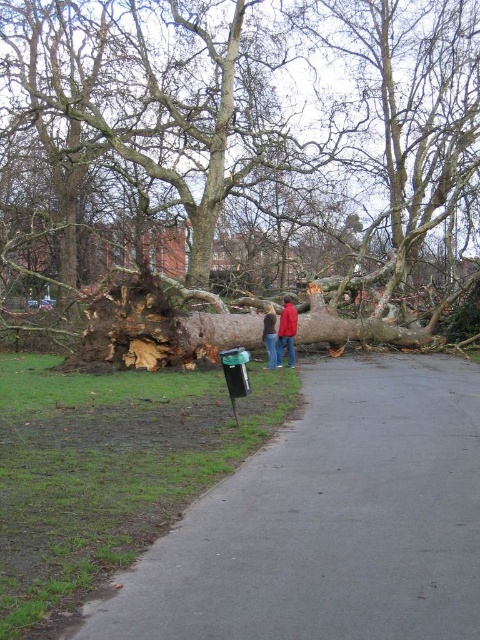
Is point (96, 99) closer to camera compared to point (312, 324)?

No, it is behind (312, 324).

Does brown rough bark tree at center have a lesser height compared to brown rough log at center?

In fact, brown rough bark tree at center may be taller than brown rough log at center.

Is point (275, 179) in front of point (321, 330)?

No, (275, 179) is behind (321, 330).

You are a GUI agent. You are given a task and a screenshot of the screen. Output one action in this format:
    pyautogui.click(x=<x>, y=<y>)
    Task: Click on the brown rough bark tree at center
    
    Given the screenshot: What is the action you would take?
    pyautogui.click(x=252, y=132)

Is point (339, 88) closer to camera compared to point (264, 317)?

That is False.

Can you confirm if brown rough bark tree at center is positioned above red jacket at center?

Correct, brown rough bark tree at center is located above red jacket at center.

Is point (49, 83) behind point (269, 330)?

Yes, point (49, 83) is farther from viewer.

Locate an element on the screen. brown rough bark tree at center is located at coordinates (252, 132).

Is gray asphalt pavement at lower left below red jacket at center?

Yes.

Can you confirm if gray asphalt pavement at lower left is wider than red jacket at center?

Yes, gray asphalt pavement at lower left is wider than red jacket at center.

Between point (217, 516) and point (274, 330), which one is positioned behind?

The point (274, 330) is more distant.

Find the location of a particular element. This screenshot has height=640, width=480. gray asphalt pavement at lower left is located at coordinates (328, 522).